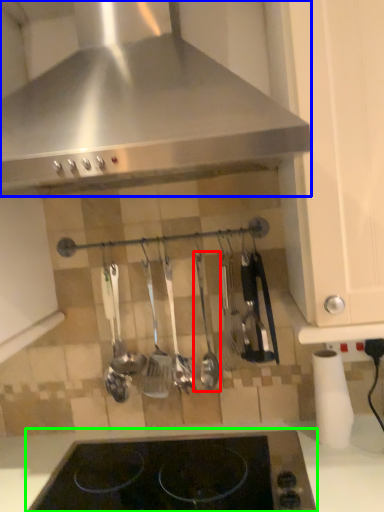
Question: Considering the real-world distances, which object is farthest from silverware (highlighted by a red box)? kitchen appliance (highlighted by a blue box) or gas stove (highlighted by a green box)?

Choices:
 (A) kitchen appliance
 (B) gas stove

Answer: (A)